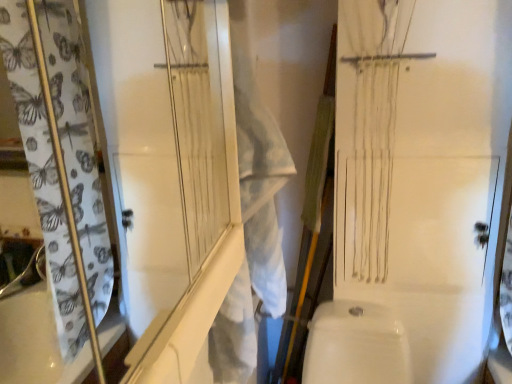
Question: Does white glossy toilet bowl at lower center come in front of white textured screen door at upper left?

Choices:
 (A) no
 (B) yes

Answer: (A)

Question: Is white glossy toilet bowl at lower center at the right side of white textured screen door at upper left?

Choices:
 (A) no
 (B) yes

Answer: (B)

Question: Considering the relative positions of white glossy toilet bowl at lower center and white textured screen door at upper left in the image provided, is white glossy toilet bowl at lower center to the left of white textured screen door at upper left from the viewer's perspective?

Choices:
 (A) no
 (B) yes

Answer: (A)

Question: Is white glossy toilet bowl at lower center bigger than white textured screen door at upper left?

Choices:
 (A) yes
 (B) no

Answer: (A)

Question: Does white glossy toilet bowl at lower center have a greater height compared to white textured screen door at upper left?

Choices:
 (A) yes
 (B) no

Answer: (B)

Question: Looking at their shapes, would you say white fabric laundry at center is wider or thinner than white glossy toilet bowl at lower center?

Choices:
 (A) thin
 (B) wide

Answer: (A)

Question: Looking at the image, does white fabric laundry at center seem bigger or smaller compared to white glossy toilet bowl at lower center?

Choices:
 (A) small
 (B) big

Answer: (A)

Question: From the image's perspective, is white fabric laundry at center above or below white glossy toilet bowl at lower center?

Choices:
 (A) above
 (B) below

Answer: (A)

Question: Visually, is white fabric laundry at center positioned to the left or to the right of white glossy toilet bowl at lower center?

Choices:
 (A) right
 (B) left

Answer: (B)

Question: From a real-world perspective, relative to white textured screen door at upper left, is white glossy toilet bowl at lower center vertically above or below?

Choices:
 (A) above
 (B) below

Answer: (B)

Question: From the image's perspective, is white glossy toilet bowl at lower center positioned above or below white textured screen door at upper left?

Choices:
 (A) above
 (B) below

Answer: (B)

Question: Considering the relative positions of white glossy toilet bowl at lower center and white textured screen door at upper left in the image provided, is white glossy toilet bowl at lower center to the left or to the right of white textured screen door at upper left?

Choices:
 (A) left
 (B) right

Answer: (B)

Question: In terms of width, does white glossy toilet bowl at lower center look wider or thinner when compared to white textured screen door at upper left?

Choices:
 (A) wide
 (B) thin

Answer: (A)

Question: Based on their positions, is white fabric laundry at center located to the left or right of white textured screen door at upper left?

Choices:
 (A) left
 (B) right

Answer: (B)

Question: Is white fabric laundry at center bigger or smaller than white textured screen door at upper left?

Choices:
 (A) big
 (B) small

Answer: (A)